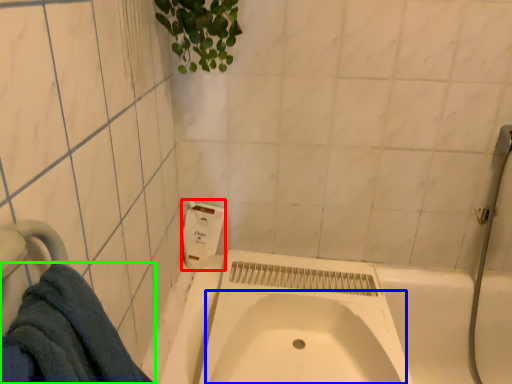
Question: Considering the real-world distances, which object is closest to soap dispenser (highlighted by a red box)? sink (highlighted by a blue box) or towel (highlighted by a green box).

Choices:
 (A) sink
 (B) towel

Answer: (A)